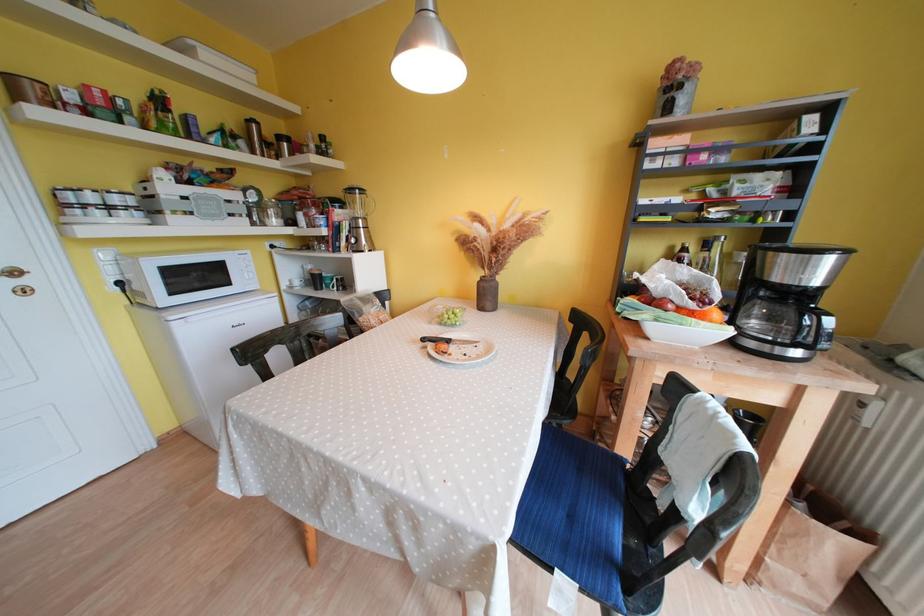
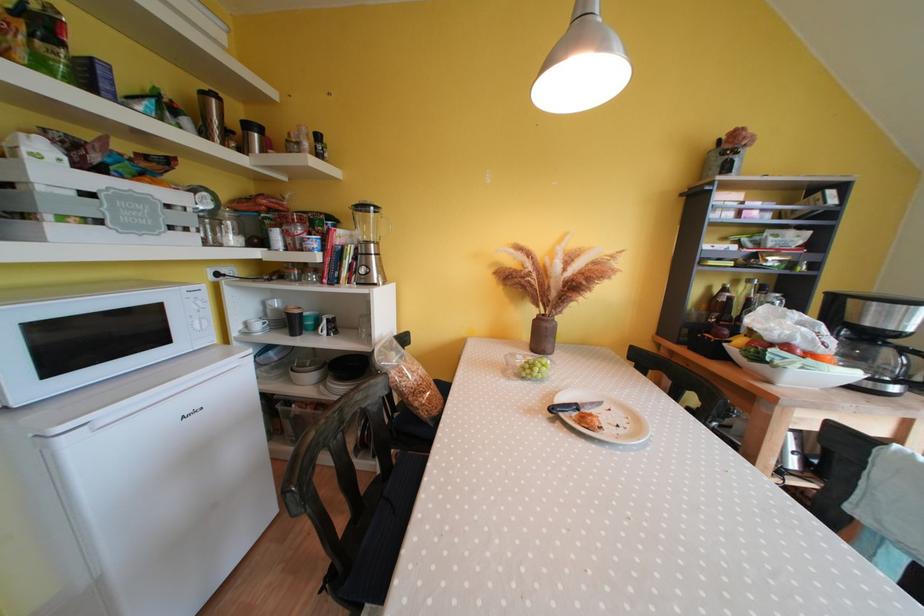
In the second image, find the point that corresponds to (x=304, y=286) in the first image.

(264, 330)